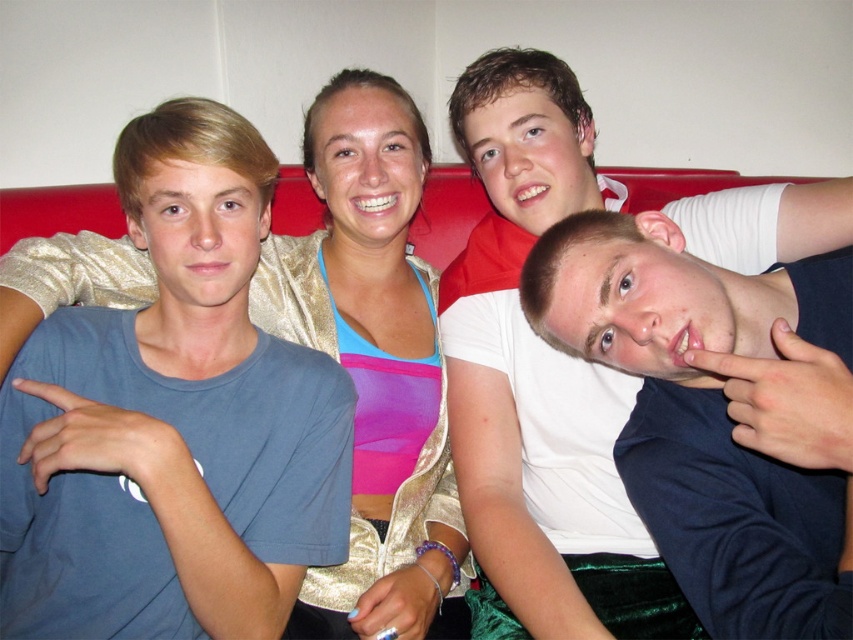
Question: Does white cotton shirt at right appear on the left side of gold shimmering jacket at center?

Choices:
 (A) yes
 (B) no

Answer: (B)

Question: Among these points, which one is nearest to the camera?

Choices:
 (A) (358, 330)
 (B) (544, 64)

Answer: (B)

Question: Which point is farther from the camera taking this photo?

Choices:
 (A) (780, 250)
 (B) (462, 577)

Answer: (B)

Question: Does white cotton shirt at right appear over gold shimmering jacket at center?

Choices:
 (A) no
 (B) yes

Answer: (B)

Question: Which point is farther to the camera?

Choices:
 (A) (495, 476)
 (B) (77, 282)

Answer: (A)

Question: Is white cotton shirt at right behind gold shimmering jacket at center?

Choices:
 (A) no
 (B) yes

Answer: (A)